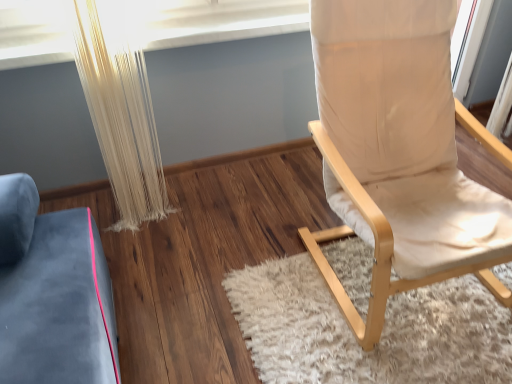
Where is `vacant area situated to the left side of white textured curtain at left`? Image resolution: width=512 pixels, height=384 pixels. vacant area situated to the left side of white textured curtain at left is located at coordinates (106, 217).